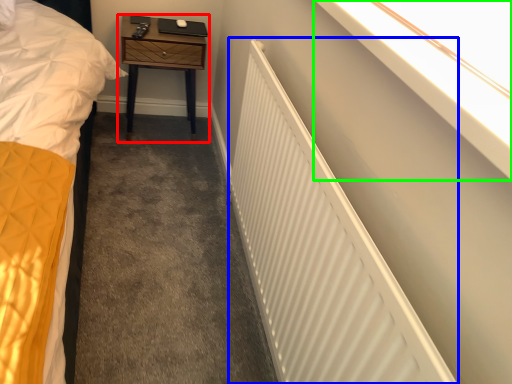
Question: Which object is positioned farthest from nightstand (highlighted by a red box)? Select from radiator (highlighted by a blue box) and window sill (highlighted by a green box).

Choices:
 (A) radiator
 (B) window sill

Answer: (B)